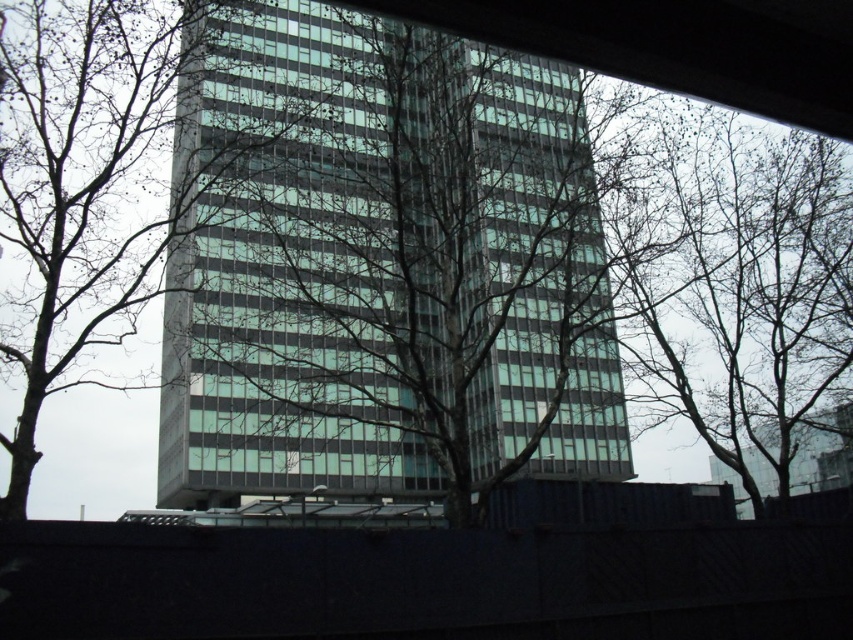
Measure the distance between green glass building at center and camera.

7.01 meters

Which is in front, point (341, 72) or point (788, 164)?

Positioned in front is point (788, 164).

Find the location of a particular element. green glass building at center is located at coordinates (379, 264).